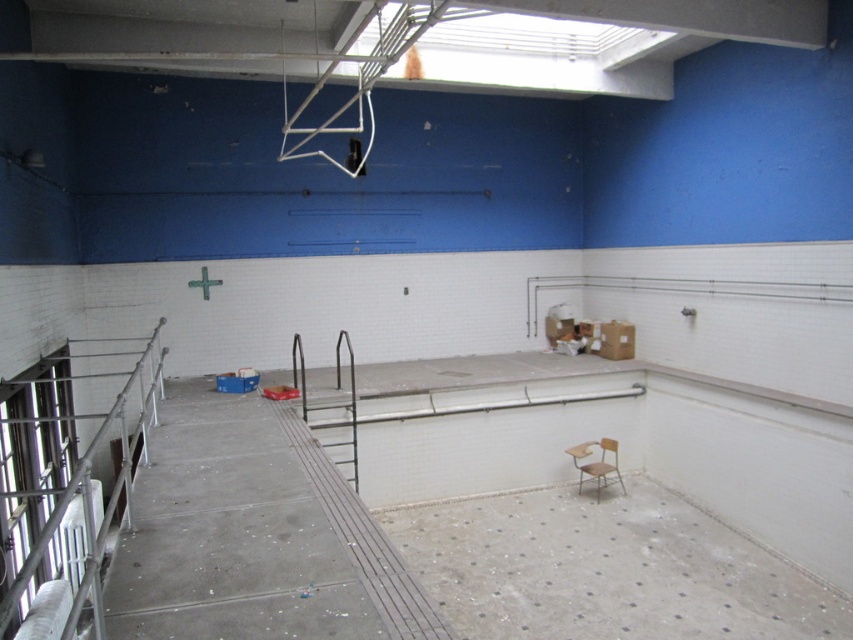
Between silver metallic railing at left and metallic gray rail at center, which one has less height?

With less height is metallic gray rail at center.

Is silver metallic railing at left above metallic gray rail at center?

Yes, silver metallic railing at left is above metallic gray rail at center.

The image size is (853, 640). What are the coordinates of `silver metallic railing at left` in the screenshot? It's located at (68, 484).

The image size is (853, 640). Find the location of `silver metallic railing at left`. silver metallic railing at left is located at coordinates (68, 484).

Does metallic gray rail at center have a greater width compared to wooden chair at center?

In fact, metallic gray rail at center might be narrower than wooden chair at center.

What do you see at coordinates (335, 387) in the screenshot?
I see `metallic gray rail at center` at bounding box center [335, 387].

Locate an element on the screen. The width and height of the screenshot is (853, 640). metallic gray rail at center is located at coordinates (335, 387).

Looking at this image, can you confirm if silver metallic railing at left is shorter than wooden chair at center?

No, silver metallic railing at left is not shorter than wooden chair at center.

Can you confirm if silver metallic railing at left is thinner than wooden chair at center?

Incorrect, silver metallic railing at left's width is not less than wooden chair at center's.

Who is more distant from viewer, [9,532] or [587,445]?

Positioned behind is point [587,445].

Identify the location of silver metallic railing at left. (68, 484).